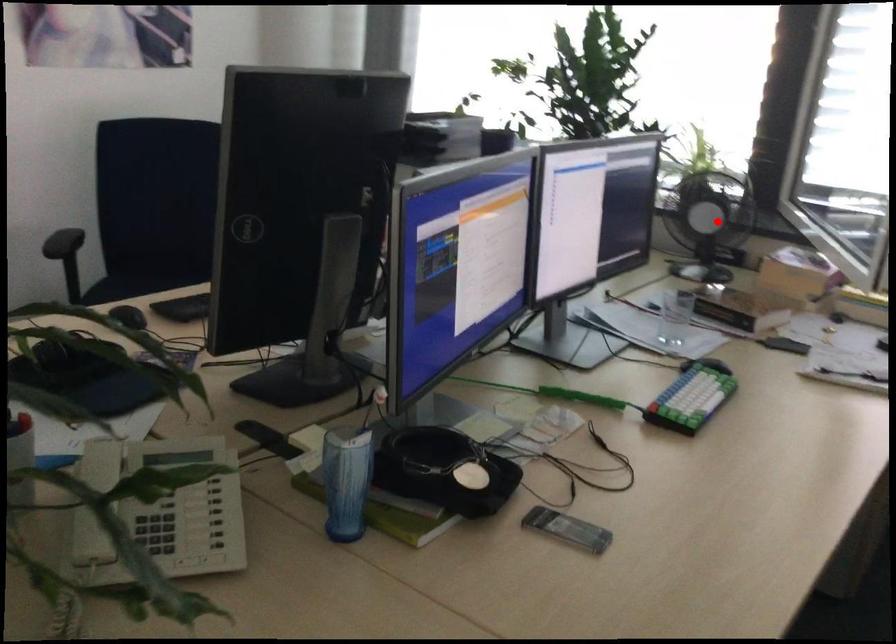
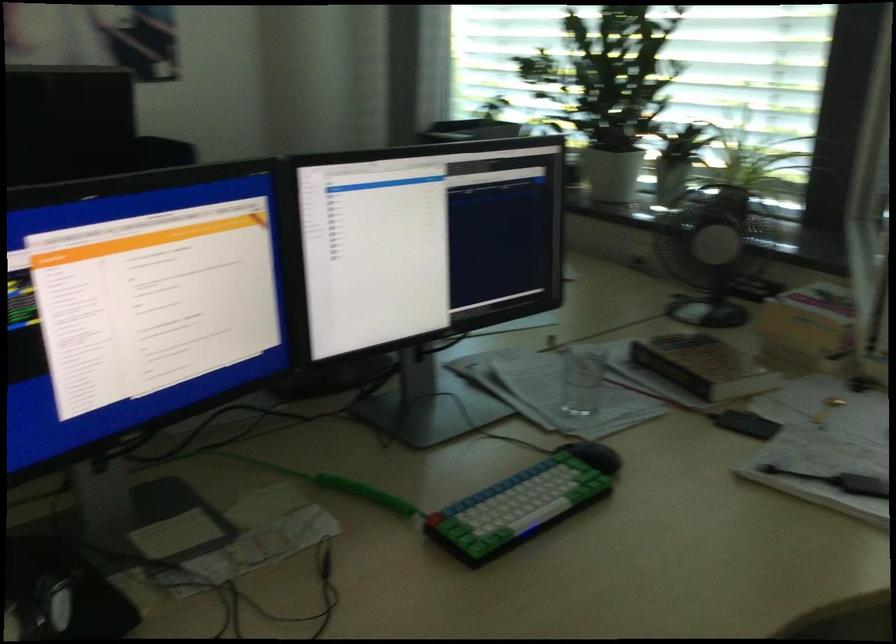
Locate, in the second image, the point that corresponds to the highlighted location in the first image.

(711, 252)